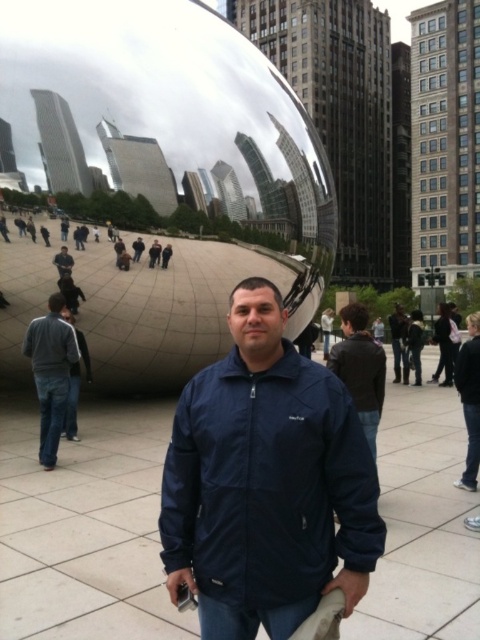
Question: Which of the following is the closest to the observer?

Choices:
 (A) (70, 339)
 (B) (57, 296)
 (C) (177, 472)
 (D) (70, 253)

Answer: (C)

Question: Which point is closer to the camera?

Choices:
 (A) matte black jacket at center
 (B) brown hair at center

Answer: (B)

Question: In this image, where is dark brown hair at center located relative to matte black head at lower left?

Choices:
 (A) left
 (B) right

Answer: (B)

Question: Is dark gray sweater at left to the right of matte blue jacket at center from the viewer's perspective?

Choices:
 (A) no
 (B) yes

Answer: (A)

Question: Which point is closer to the camera?

Choices:
 (A) (471, 328)
 (B) (63, 404)
 (C) (68, 260)

Answer: (A)

Question: Can you confirm if dark brown hair at center is positioned below matte black head at lower left?

Choices:
 (A) yes
 (B) no

Answer: (B)